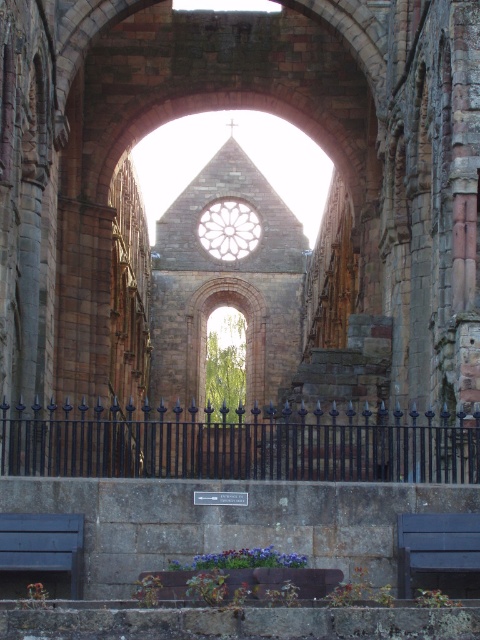
You are standing inside the historic stone church facing the central archway. There are two points marked in the scene. The first point is at coordinates point (62, 516) and the second is at point (400, 556). Which point is closer to you?

Point (400, 556) is closer to you because it is in front of point (62, 516).